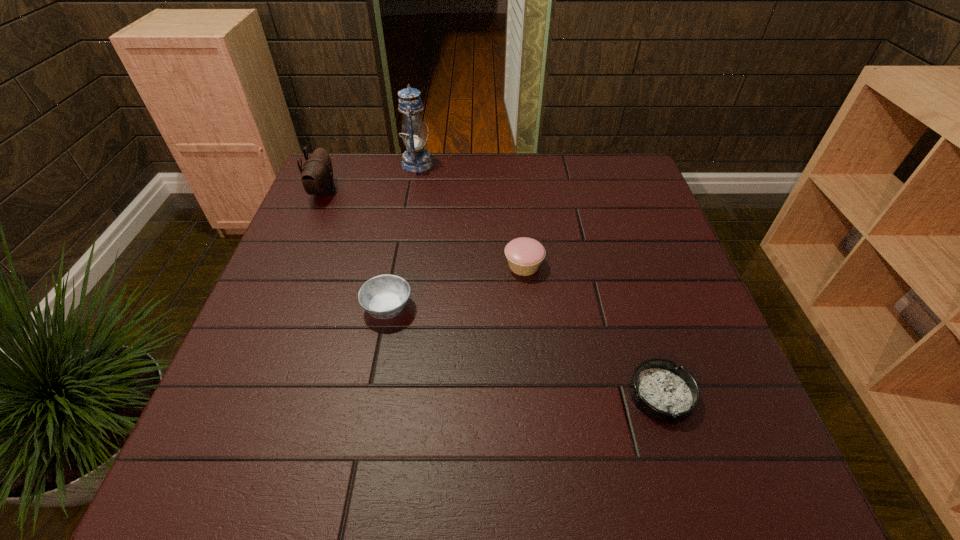
Locate an element on the screen. The height and width of the screenshot is (540, 960). vacant point that satisfies the following two spatial constraints: 1. on the back side of the cupcake; 2. on the left side of the fourth tallest object is located at coordinates coord(396,266).

This screenshot has width=960, height=540. What are the coordinates of `free spot that satisfies the following two spatial constraints: 1. with the flap open on the leftmost object; 2. on the back side of the cupcake` in the screenshot? It's located at (293, 266).

Find the location of a particular element. free space that satisfies the following two spatial constraints: 1. on the front side of the nearest object; 2. on the right side of the farther ashtray is located at coordinates (371, 395).

In order to click on vacant space that satisfies the following two spatial constraints: 1. with the flap open on the pouch; 2. on the left side of the shorter ashtray in this screenshot , I will do `click(238, 395)`.

This screenshot has width=960, height=540. Identify the location of vacant area in the image that satisfies the following two spatial constraints: 1. with the flap open on the left ashtray; 2. on the left side of the second farthest object. (275, 308).

Find the location of a particular element. The image size is (960, 540). free point that satisfies the following two spatial constraints: 1. on the back side of the third shortest object; 2. on the front-facing side of the farthest object is located at coordinates (514, 164).